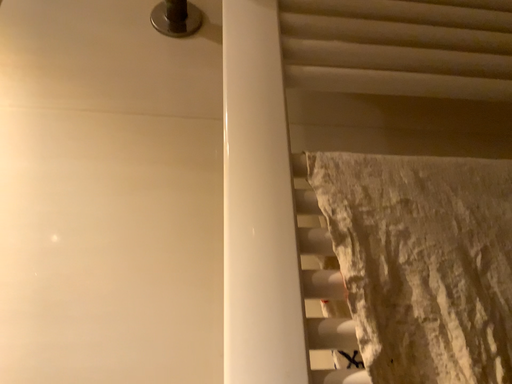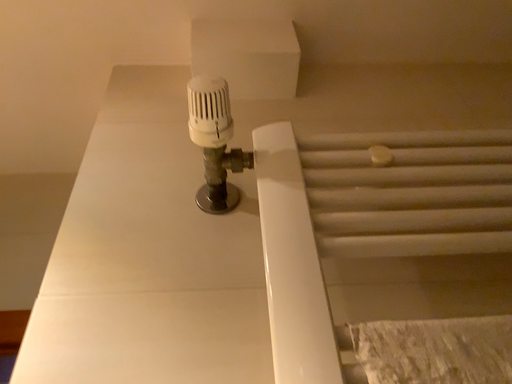
Question: How did the camera likely rotate when shooting the video?

Choices:
 (A) rotated downward
 (B) rotated upward

Answer: (B)